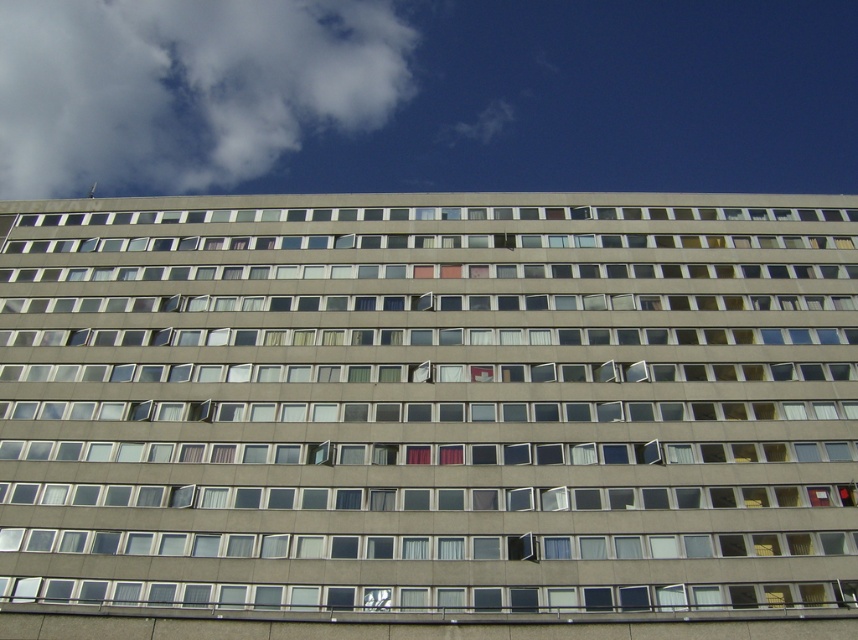
Looking at this image, you are standing in front of the large multi story building and notice the matte gray window at center. Can you determine the exact coordinates of this window based on the building structure?

The matte gray window at center is located at point (x=429, y=403).

You are an architect designing a new building and want to ensure that the matte gray window at center and the white fluffy cloud at upper left in the reference image are proportionally accurate in your model. Which object is shorter in height?

The matte gray window at center is shorter than the white fluffy cloud at upper left in the reference image.

You are standing outside the building and looking at the matte gray window at center and the white fluffy cloud at upper left. Which object is located more to the right side?

The matte gray window at center is positioned on the right side of white fluffy cloud at upper left, so it is more to the right.